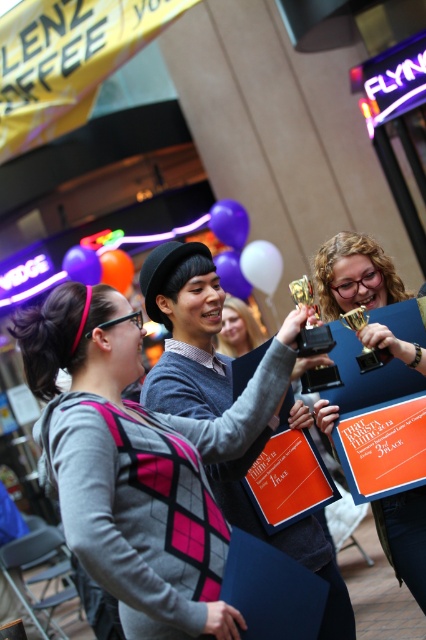
Based on the photo, how far apart are shiny gold trophy at center and matte gray sweater at center?

shiny gold trophy at center and matte gray sweater at center are 2.87 meters apart from each other.

Between point (385, 257) and point (255, 337), which one is positioned in front?

Positioned in front is point (385, 257).

The image size is (426, 640). I want to click on shiny gold trophy at center, so 354,275.

Looking at this image, can you confirm if pink diamond-patterned sweater at center is bigger than matte gray sweater at center?

Indeed, pink diamond-patterned sweater at center has a larger size compared to matte gray sweater at center.

Does pink diamond-patterned sweater at center appear under matte gray sweater at center?

Yes, pink diamond-patterned sweater at center is below matte gray sweater at center.

Where is `pink diamond-patterned sweater at center`? pink diamond-patterned sweater at center is located at coordinates (140, 461).

Based on the photo, who is higher up, pink diamond-patterned sweater at center or shiny gold trophy at center?

Positioned higher is shiny gold trophy at center.

Does pink diamond-patterned sweater at center have a greater width compared to shiny gold trophy at center?

Yes.

Image resolution: width=426 pixels, height=640 pixels. What do you see at coordinates (140, 461) in the screenshot?
I see `pink diamond-patterned sweater at center` at bounding box center [140, 461].

Locate an element on the screen. pink diamond-patterned sweater at center is located at coordinates (140, 461).